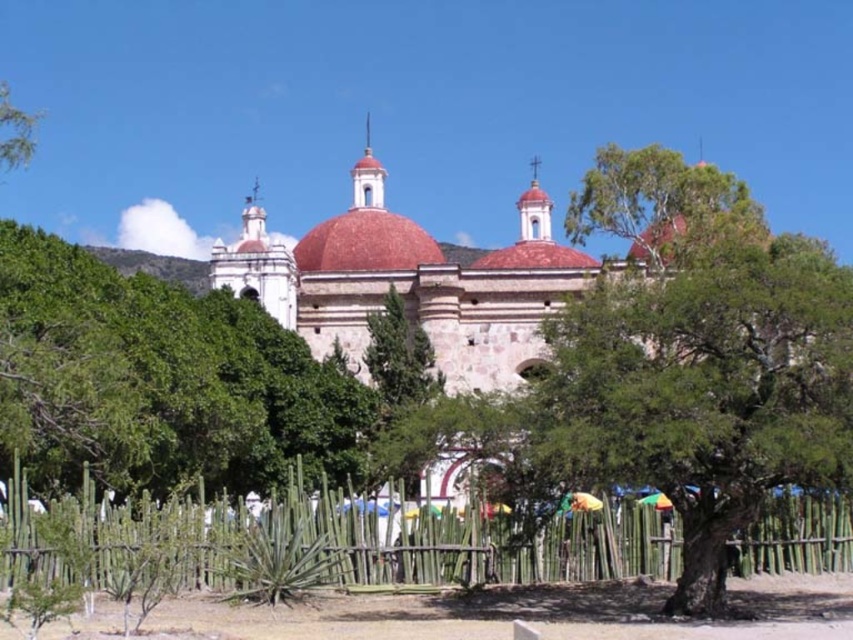
Who is positioned more to the right, green leafy tree at center or green bamboo fence at lower center?

green bamboo fence at lower center is more to the right.

Is point (171, 324) positioned before point (589, 518)?

No, (171, 324) is behind (589, 518).

Between point (3, 266) and point (222, 568), which one is positioned behind?

The point (3, 266) is more distant.

The width and height of the screenshot is (853, 640). In order to click on green leafy tree at center in this screenshot , I will do `click(158, 380)`.